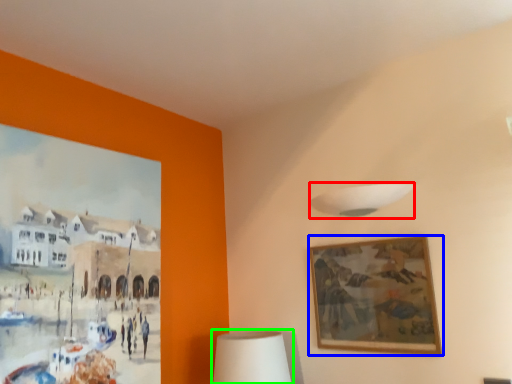
Question: Considering the real-world distances, which object is closest to lamp (highlighted by a red box)? picture frame (highlighted by a blue box) or table lamp (highlighted by a green box).

Choices:
 (A) picture frame
 (B) table lamp

Answer: (A)